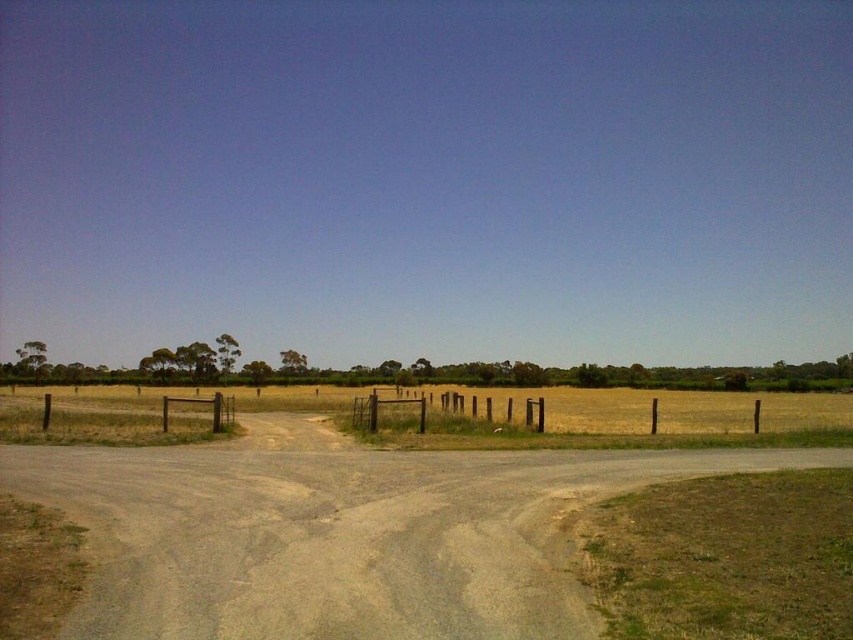
Question: Which of these objects is positioned closest to the brown wooden fence at center?

Choices:
 (A) dull gray gravel at center
 (B) yellow grass at center

Answer: (A)

Question: Does dull gray gravel at center appear on the left side of brown wooden fence at center?

Choices:
 (A) yes
 (B) no

Answer: (A)

Question: Can you confirm if dull gray gravel at center is positioned to the left of brown wooden fence at center?

Choices:
 (A) no
 (B) yes

Answer: (B)

Question: Which object is closer to the camera taking this photo?

Choices:
 (A) yellow grass at center
 (B) brown wooden fence at center

Answer: (A)

Question: Does yellow grass at center have a smaller size compared to brown wooden fence at center?

Choices:
 (A) yes
 (B) no

Answer: (B)

Question: Considering the real-world distances, which object is closest to the dull gray gravel at center?

Choices:
 (A) brown wooden fence at center
 (B) yellow grass at center

Answer: (A)